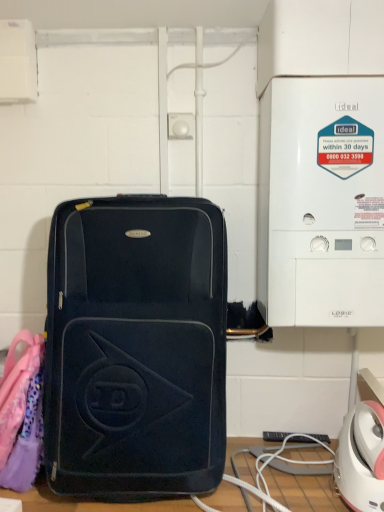
Question: Is white plastic boiler at right inside the boundaries of matte black suitcase at center, or outside?

Choices:
 (A) outside
 (B) inside

Answer: (A)

Question: From a real-world perspective, relative to matte black suitcase at center, is white plastic boiler at right vertically above or below?

Choices:
 (A) above
 (B) below

Answer: (A)

Question: Is point (377, 281) closer or farther from the camera than point (162, 312)?

Choices:
 (A) farther
 (B) closer

Answer: (A)

Question: Visually, is matte black suitcase at center positioned to the left or to the right of white plastic boiler at right?

Choices:
 (A) right
 (B) left

Answer: (B)

Question: Looking at their shapes, would you say matte black suitcase at center is wider or thinner than white plastic boiler at right?

Choices:
 (A) wide
 (B) thin

Answer: (A)

Question: Is matte black suitcase at center in front of or behind white plastic boiler at right in the image?

Choices:
 (A) behind
 (B) front

Answer: (B)

Question: Is point (119, 392) positioned closer to the camera than point (322, 293)?

Choices:
 (A) closer
 (B) farther

Answer: (A)